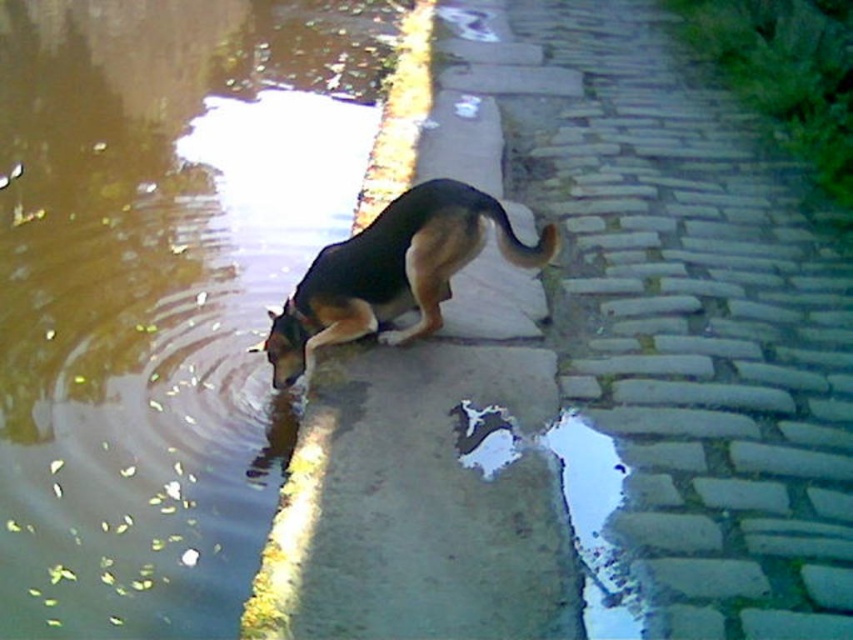
Can you confirm if brown water at edge left is wider than black and tan fur dog at center?

No, brown water at edge left is not wider than black and tan fur dog at center.

What do you see at coordinates (160, 289) in the screenshot? This screenshot has width=853, height=640. I see `brown water at edge left` at bounding box center [160, 289].

This screenshot has height=640, width=853. Find the location of `brown water at edge left`. brown water at edge left is located at coordinates (160, 289).

Does brown water at edge left appear under brick pavement at center?

No, brown water at edge left is not below brick pavement at center.

Who is more distant from viewer, (x=236, y=278) or (x=596, y=349)?

Point (x=236, y=278)

At what (x,y) coordinates should I click in order to perform the action: click on brown water at edge left. Please return your answer as a coordinate pair (x, y). Looking at the image, I should click on (160, 289).

Where is `brown water at edge left`? The image size is (853, 640). brown water at edge left is located at coordinates (160, 289).

Between point (776, 186) and point (312, 352), which one is positioned behind?

Point (776, 186)

Measure the distance between point (755,333) and camera.

They are 3.32 meters apart.

Measure the distance between point (x=601, y=346) and camera.

Point (x=601, y=346) is 3.25 meters from camera.

Where is `brick pavement at center`? brick pavement at center is located at coordinates (698, 332).